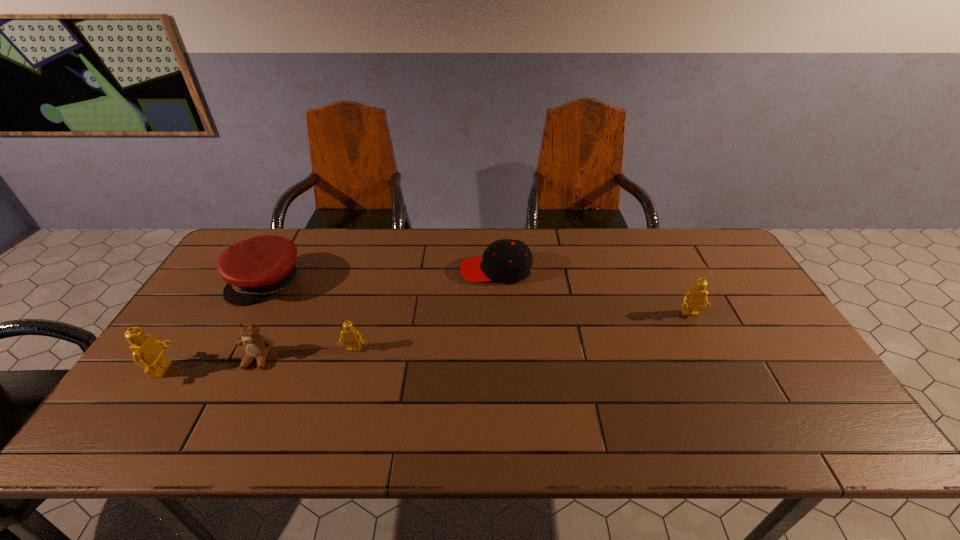
To achieve uniform spacing by inserting another Lego among them, please point to a free space for this new Lego. Please provide its 2D coordinates. Your answer should be formatted as a tuple, i.e. [(x, y)], where the tuple contains the x and y coordinates of a point satisfying the conditions above.

[(529, 331)]